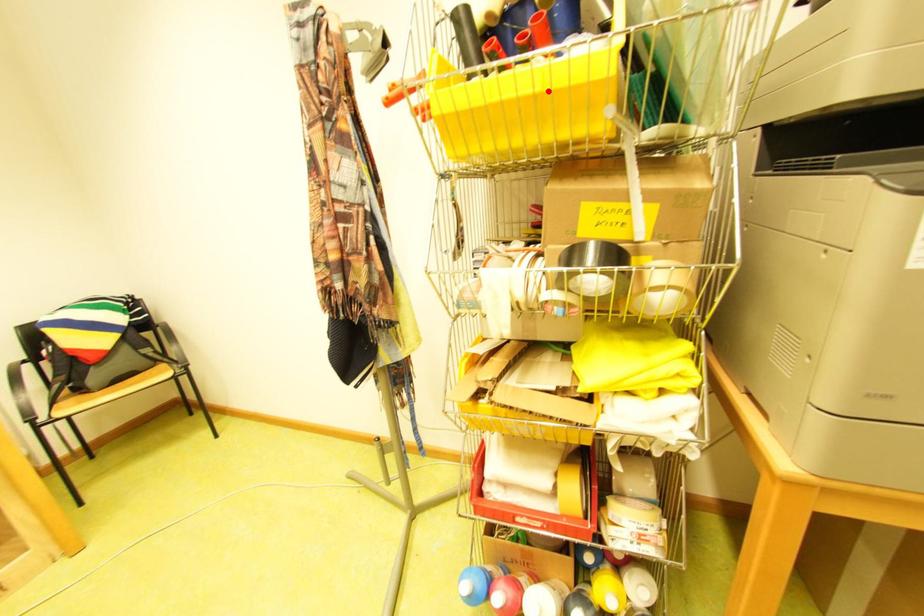
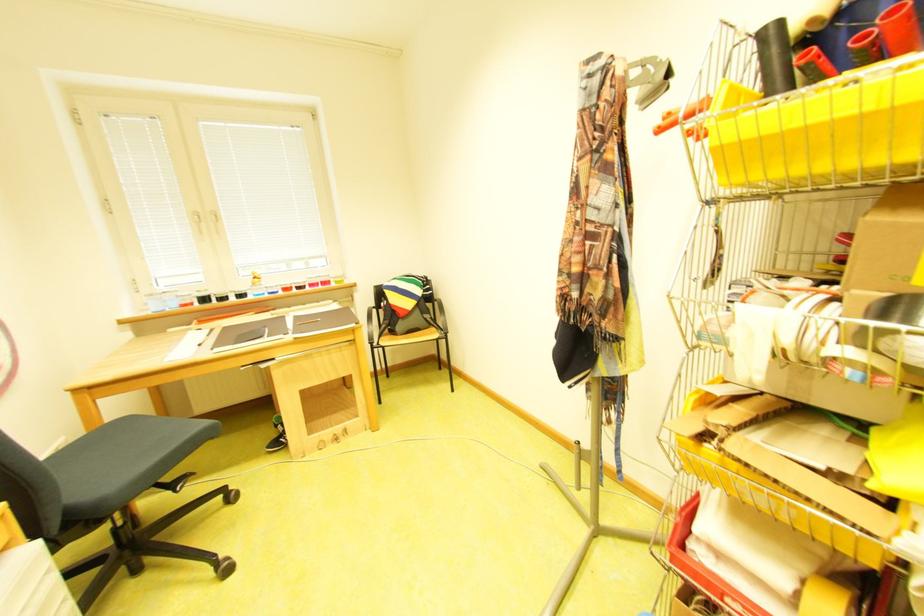
Question: A red point is marked in image1. In image2, is the corresponding 3D point closer to the camera or farther? Reply with the corresponding letter.

Choices:
 (A) The corresponding 3D point is closer.
 (B) The corresponding 3D point is farther.

Answer: (B)